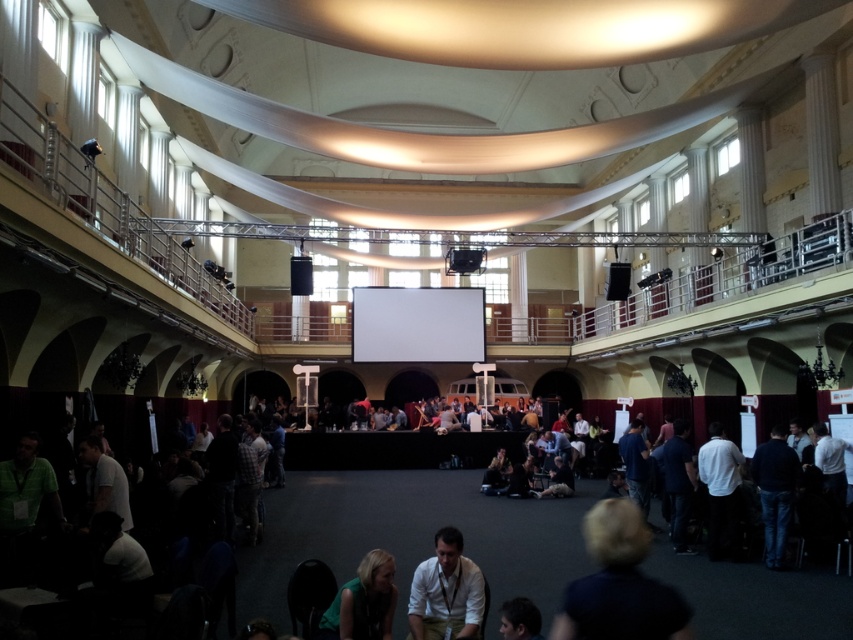
Between blonde hair at lower right and green fabric shirt at lower center, which one appears on the left side from the viewer's perspective?

green fabric shirt at lower center is more to the left.

Is point (567, 609) positioned before point (390, 568)?

Yes, it is in front of point (390, 568).

The width and height of the screenshot is (853, 640). I want to click on blonde hair at lower right, so click(619, 582).

Between point (474, 624) and point (340, 625), which one is positioned in front?

Point (340, 625) is in front.

Looking at this image, is white shirt at lower center to the left of green fabric shirt at lower center from the viewer's perspective?

No, white shirt at lower center is not to the left of green fabric shirt at lower center.

I want to click on white shirt at lower center, so click(x=445, y=592).

Which of these two, blonde hair at lower right or dark brown hair at lower center, stands taller?

With more height is blonde hair at lower right.

Between point (585, 589) and point (519, 628), which one is positioned in front?

Point (585, 589) is more forward.

Locate an element on the screen. This screenshot has height=640, width=853. blonde hair at lower right is located at coordinates (619, 582).